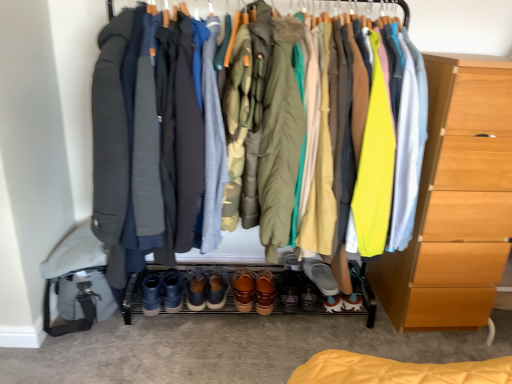
What are the coordinates of `brown leather shoes at center, the 5th footwear when ordered from left to right` in the screenshot? It's located at (264, 292).

What is the approximate height of matte olive green coat at center, the 1th robe when ordered from right to left?

matte olive green coat at center, the 1th robe when ordered from right to left, is 35.86 inches tall.

Where is `gray suede shoe at center, which ranks as the 1th footwear in right-to-left order`? The image size is (512, 384). gray suede shoe at center, which ranks as the 1th footwear in right-to-left order is located at coordinates (320, 276).

At what (x,y) coordinates should I click in order to perform the action: click on brown leather shoes at center, the 5th footwear when ordered from left to right. Please return your answer as a coordinate pair (x, y). The width and height of the screenshot is (512, 384). Looking at the image, I should click on (264, 292).

From a real-world perspective, relative to brown leather shoes at center, which is counted as the third footwear, starting from the left, is gray suede shoe at center, the 6th footwear when ordered from left to right, vertically above or below?

In terms of real-world spatial position, gray suede shoe at center, the 6th footwear when ordered from left to right, is above brown leather shoes at center, which is counted as the third footwear, starting from the left.

From a real-world perspective, count 4th footwears upward from the brown leather shoes at center, which is counted as the third footwear, starting from the left, and point to it. Please provide its 2D coordinates.

[(320, 276)]

Considering the positions of point (327, 272) and point (248, 285), is point (327, 272) closer or farther from the camera than point (248, 285)?

Point (327, 272).

Is light wood chest of drawers at right far away from matte olive green coat at center, the 1th robe when ordered from right to left?

No, there isn't a large distance between light wood chest of drawers at right and matte olive green coat at center, the 1th robe when ordered from right to left.

Consider the image. Considering the sizes of light wood chest of drawers at right and matte olive green coat at center, the 1th robe when ordered from right to left, in the image, is light wood chest of drawers at right bigger or smaller than matte olive green coat at center, the 1th robe when ordered from right to left,?

light wood chest of drawers at right is bigger than matte olive green coat at center, the 1th robe when ordered from right to left.

Is light wood chest of drawers at right positioned behind matte olive green coat at center, the 1th robe when ordered from right to left?

Yes, it is behind matte olive green coat at center, the 1th robe when ordered from right to left.

Locate an element on the screen. The width and height of the screenshot is (512, 384). the 3rd robe in front of the light wood chest of drawers at right is located at coordinates pos(280,139).

The height and width of the screenshot is (384, 512). In order to click on the 1st robe above when counting from the matte black jacket at center (from the image's perspective) in this screenshot , I will do `click(147, 145)`.

Is matte gray robe at left, which is counted as the 4th robe, starting from the right, surrounded by matte black jacket at center?

Absolutely, matte gray robe at left, which is counted as the 4th robe, starting from the right, is inside matte black jacket at center.

Does matte black jacket at center appear on the left side of matte gray robe at left, the 1th robe when ordered from left to right?

No.

Considering the sizes of matte black jacket at center and matte gray robe at left, which is counted as the 4th robe, starting from the right, in the image, is matte black jacket at center taller or shorter than matte gray robe at left, which is counted as the 4th robe, starting from the right,?

Clearly, matte black jacket at center is taller compared to matte gray robe at left, which is counted as the 4th robe, starting from the right.

Relative to matte olive green coat at center, marked as the fourth robe in a left-to-right arrangement, is brown suede shoes at center, placed as the 2th footwear when sorted from left to right, in front or behind?

Visually, brown suede shoes at center, placed as the 2th footwear when sorted from left to right, is located behind matte olive green coat at center, marked as the fourth robe in a left-to-right arrangement.

Which object is wider, brown suede shoes at center, placed as the 2th footwear when sorted from left to right, or matte olive green coat at center, the 1th robe when ordered from right to left?

matte olive green coat at center, the 1th robe when ordered from right to left, is wider.

Looking at this image, could you tell me if brown suede shoes at center, the fifth footwear in the right-to-left sequence, is turned towards matte olive green coat at center, the 1th robe when ordered from right to left?

No, brown suede shoes at center, the fifth footwear in the right-to-left sequence, does not turn towards matte olive green coat at center, the 1th robe when ordered from right to left.

Is matte olive green coat at center, marked as the fourth robe in a left-to-right arrangement, at the back of leather shoes at center, which is counted as the 4th footwear, starting from the left?

No, leather shoes at center, which is counted as the 4th footwear, starting from the left, is not facing the opposite direction of matte olive green coat at center, marked as the fourth robe in a left-to-right arrangement.

From the image's perspective, which footwear is the 6th one below the matte olive green coat at center, marked as the fourth robe in a left-to-right arrangement? Please provide its 2D coordinates.

[(249, 290)]

Who is smaller, leather shoes at center, which is counted as the 4th footwear, starting from the left, or matte olive green coat at center, the 1th robe when ordered from right to left?

leather shoes at center, which is counted as the 4th footwear, starting from the left, is smaller.

Which is closer, (216, 275) or (263, 169)?

The point (263, 169) is more forward.

Is gray woolen robe at center, placed as the second robe when sorted from left to right, positioned with its back to brown suede shoes at center, the sixth footwear positioned from the right?

No, gray woolen robe at center, placed as the second robe when sorted from left to right, is not facing the opposite direction of brown suede shoes at center, the sixth footwear positioned from the right.

Considering the relative sizes of gray woolen robe at center, placed as the second robe when sorted from left to right, and brown suede shoes at center, the sixth footwear positioned from the right, in the image provided, is gray woolen robe at center, placed as the second robe when sorted from left to right, shorter than brown suede shoes at center, the sixth footwear positioned from the right,?

Incorrect, the height of gray woolen robe at center, placed as the second robe when sorted from left to right, does not fall short of that of brown suede shoes at center, the sixth footwear positioned from the right.

From the picture: From the image's perspective, between gray woolen robe at center, the 3th robe positioned from the right, and brown suede shoes at center, the sixth footwear positioned from the right, who is located below?

From the image's view, brown suede shoes at center, the sixth footwear positioned from the right, is below.

Considering the relative positions of matte black jacket at center and gray suede shoe at center, which ranks as the 1th footwear in right-to-left order, in the image provided, is matte black jacket at center to the right of gray suede shoe at center, which ranks as the 1th footwear in right-to-left order, from the viewer's perspective?

No, matte black jacket at center is not to the right of gray suede shoe at center, which ranks as the 1th footwear in right-to-left order.

From the picture: Can you confirm if matte black jacket at center is bigger than gray suede shoe at center, the 6th footwear when ordered from left to right?

Yes.

Is matte black jacket at center looking in the opposite direction of gray suede shoe at center, the 6th footwear when ordered from left to right?

That's right, matte black jacket at center is facing away from gray suede shoe at center, the 6th footwear when ordered from left to right.

I want to click on the 1st footwear behind the matte black jacket at center, so click(x=320, y=276).

Starting from the brown leather shoes at center, which is counted as the third footwear, starting from the left, which footwear is the 3rd one to the right? Please provide its 2D coordinates.

[(320, 276)]

This screenshot has width=512, height=384. What are the coordinates of `the 3rd robe positioned above the light wood chest of drawers at right (from a real-world perspective)` in the screenshot? It's located at (280, 139).

Which object lies nearer to the anchor point brown suede shoes at center, the fifth footwear in the right-to-left sequence, brown suede shoes at center, the sixth footwear positioned from the right, or leather shoes at center, the 3th footwear in the right-to-left sequence?

Among the two, brown suede shoes at center, the sixth footwear positioned from the right, is located nearer to brown suede shoes at center, the fifth footwear in the right-to-left sequence.

From the image, which object appears to be farther from leather shoes at center, which is counted as the 4th footwear, starting from the left, matte olive green coat at center, the 1th robe when ordered from right to left, or gray woolen robe at center, the 3th robe positioned from the right?

matte olive green coat at center, the 1th robe when ordered from right to left.

From the image, which object appears to be farther from matte olive green coat at center, the 1th robe when ordered from right to left, brown suede shoes at center, the fifth footwear in the right-to-left sequence, or light wood chest of drawers at right?

brown suede shoes at center, the fifth footwear in the right-to-left sequence.

Considering their positions, is gray woolen robe at center, placed as the second robe when sorted from left to right, positioned closer to brown suede shoes at center, the first footwear from the left, than matte gray robe at left, which is counted as the 4th robe, starting from the right?

Based on the image, matte gray robe at left, which is counted as the 4th robe, starting from the right, appears to be nearer to brown suede shoes at center, the first footwear from the left.

Based on their spatial positions, is camouflage fabric robe at center, placed as the 3th robe when sorted from left to right, or brown suede shoes at center, the fifth footwear in the right-to-left sequence, closer to matte black jacket at center?

camouflage fabric robe at center, placed as the 3th robe when sorted from left to right, lies closer to matte black jacket at center than the other object.

Considering their positions, is light wood chest of drawers at right positioned closer to brown leather shoes at center, which is the second footwear from right to left, than gray woolen robe at center, the 3th robe positioned from the right?

The object closer to brown leather shoes at center, which is the second footwear from right to left, is gray woolen robe at center, the 3th robe positioned from the right.

Consider the image. Estimate the real-world distances between objects in this image. Which object is further from matte olive green coat at center, the 1th robe when ordered from right to left, brown suede shoes at center, the fifth footwear in the right-to-left sequence, or gray woolen robe at center, placed as the second robe when sorted from left to right?

brown suede shoes at center, the fifth footwear in the right-to-left sequence, is positioned further to the anchor matte olive green coat at center, the 1th robe when ordered from right to left.

Looking at the image, which one is located further to brown leather shoes at center, the 5th footwear when ordered from left to right, gray woolen robe at center, placed as the second robe when sorted from left to right, or matte black jacket at center?

Based on the image, matte black jacket at center appears to be further to brown leather shoes at center, the 5th footwear when ordered from left to right.

This screenshot has width=512, height=384. Identify the location of footwear situated between matte olive green coat at center, marked as the fourth robe in a left-to-right arrangement, and light wood chest of drawers at right from left to right. (320, 276).

The image size is (512, 384). I want to click on robe between brown leather shoes at center, the fourth footwear in the right-to-left sequence, and light wood chest of drawers at right from left to right, so click(x=280, y=139).

This screenshot has height=384, width=512. I want to click on footwear between brown suede shoes at center, the first footwear from the left, and brown leather shoes at center, the fourth footwear in the right-to-left sequence, so click(217, 288).

Where is `footwear that lies between matte black jacket at center and brown suede shoes at center, the sixth footwear positioned from the right, from top to bottom`? The height and width of the screenshot is (384, 512). footwear that lies between matte black jacket at center and brown suede shoes at center, the sixth footwear positioned from the right, from top to bottom is located at coordinates (320, 276).